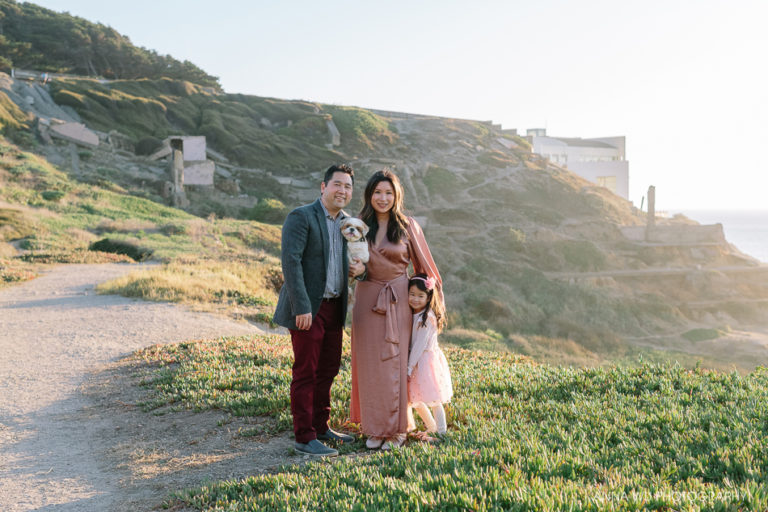
This screenshot has height=512, width=768. Identify the location of floor. (590, 163).